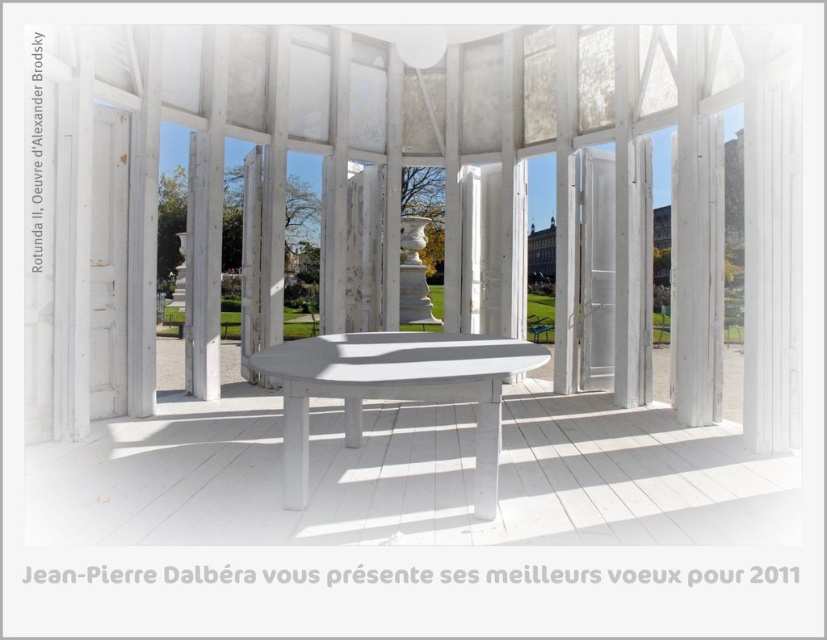
You are an architect designing a new outdoor space. You need to ensure that the white wood window at center and the white painted wood table at center are positioned so that the table does not block the view through the window. Given their sizes, is this arrangement feasible?

The white wood window at center has a greater height compared to the white painted wood table at center. Since the window is taller, the table, being shorter, will not block the view through the window as long as it is placed in front of the window at an appropriate distance.

You are an architect designing a new outdoor space. You have a white wood window at center and a white painted wood table at center in your design. Which object has a smaller width according to the scene description?

The white wood window at center has a smaller width than the white painted wood table at center.